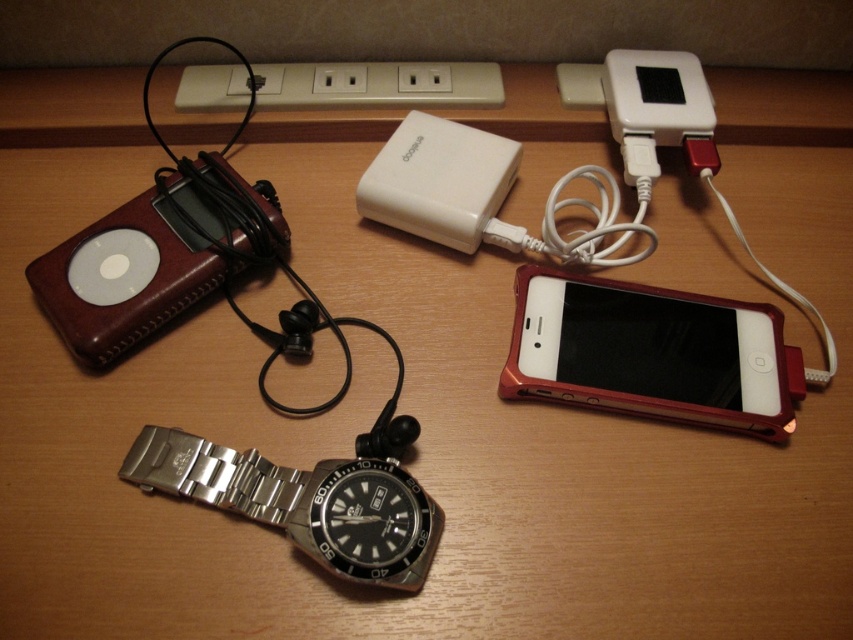
You are looking at the arrangement of items on the desk. There are two points marked as point (556,275) and point (212,112). Which point is closer to your view?

Point (556,275) is closer to the camera than point (212,112).

You have a metallic red smartphone at lower right and a leather ipod at left on a desk. You need to place a 15 inch laptop between them. Will there be enough space?

The metallic red smartphone at lower right and the leather ipod at left are 17.16 inches apart. Since the laptop is 15 inches wide, there is sufficient space between them to place the laptop.

You are organizing items on a desk and need to place a new metallic red smartphone at lower right. According to the scene, where should you position it relative to the other items?

The metallic red smartphone at lower right should be placed at the coordinates point [648,353] relative to the other items on the desk.